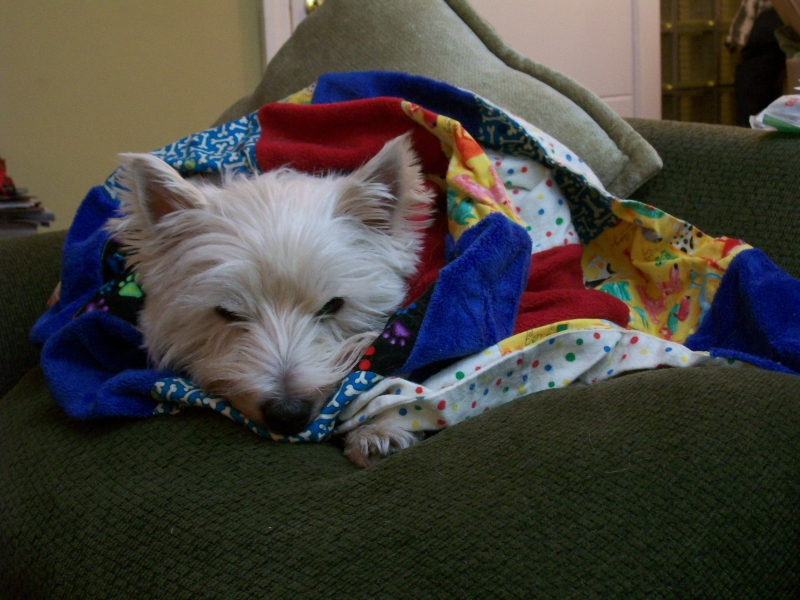
Where is `couch`? Image resolution: width=800 pixels, height=600 pixels. couch is located at coordinates (649, 382).